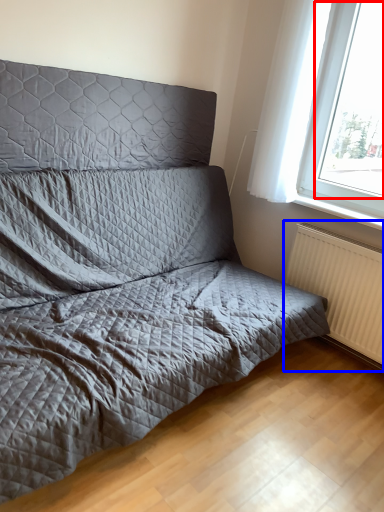
Question: Which of the following is the closest to the observer, window screen (highlighted by a red box) or radiator (highlighted by a blue box)?

Choices:
 (A) window screen
 (B) radiator

Answer: (A)